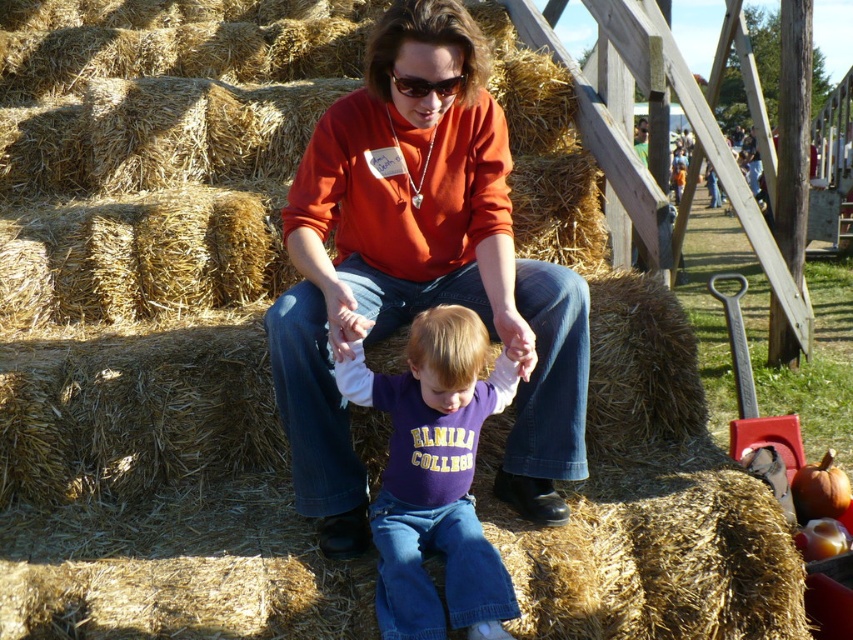
Who is more forward, (279, 314) or (396, 88)?

Point (396, 88) is in front.

The image size is (853, 640). Identify the location of orange cotton shirt at center. (419, 269).

Find the location of a particular element. The width and height of the screenshot is (853, 640). orange cotton shirt at center is located at coordinates (419, 269).

Who is positioned more to the left, orange cotton shirt at center or purple cotton shirt at center?

From the viewer's perspective, purple cotton shirt at center appears more on the left side.

Who is lower down, orange cotton shirt at center or purple cotton shirt at center?

Positioned lower is purple cotton shirt at center.

What are the coordinates of `orange cotton shirt at center` in the screenshot? It's located at (419, 269).

Who is positioned more to the right, purple cotton shirt at center or matte black sunglasses at center?

matte black sunglasses at center is more to the right.

Where is `purple cotton shirt at center`? The height and width of the screenshot is (640, 853). purple cotton shirt at center is located at coordinates (434, 477).

Find the location of a particular element. purple cotton shirt at center is located at coordinates (434, 477).

At what (x,y) coordinates should I click in order to perform the action: click on purple cotton shirt at center. Please return your answer as a coordinate pair (x, y). This screenshot has width=853, height=640. Looking at the image, I should click on (434, 477).